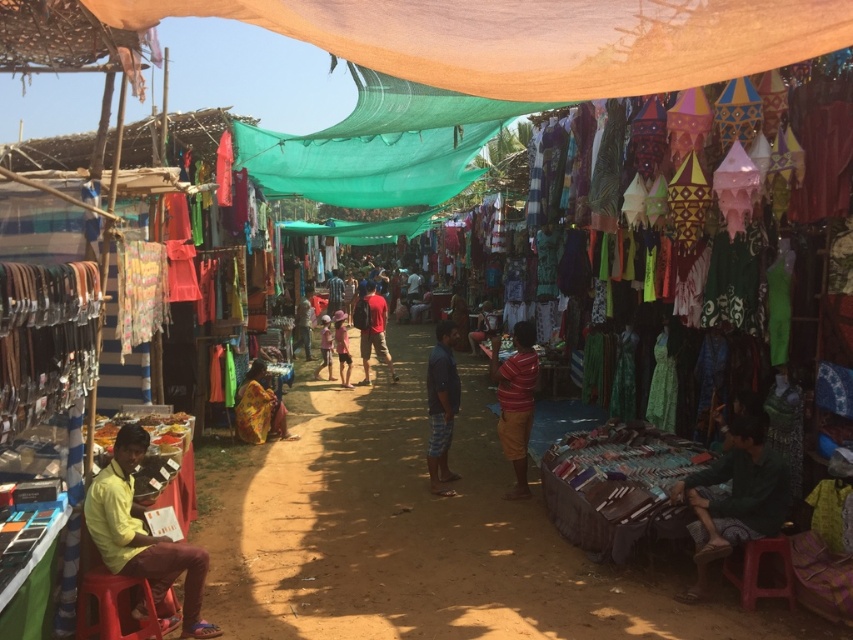
How much distance is there between yellow plastic stool at lower left and light blue fabric at center?

8.63 meters

Does yellow plastic stool at lower left have a lesser height compared to light blue fabric at center?

Yes.

This screenshot has width=853, height=640. Describe the element at coordinates (113, 608) in the screenshot. I see `yellow plastic stool at lower left` at that location.

You are a GUI agent. You are given a task and a screenshot of the screen. Output one action in this format:
    pyautogui.click(x=<x>, y=<y>)
    Task: Click on the yellow plastic stool at lower left
    The image size is (853, 640).
    Given the screenshot: What is the action you would take?
    pyautogui.click(x=113, y=608)

Does point (727, 442) come closer to viewer compared to point (517, 349)?

Yes, point (727, 442) is in front of point (517, 349).

Who is more distant from viewer, (x=770, y=525) or (x=537, y=374)?

The point (x=537, y=374) is more distant.

Which is in front, point (699, 516) or point (521, 404)?

Point (699, 516) is in front.

This screenshot has width=853, height=640. In order to click on green fabric at lower right in this screenshot , I will do `click(734, 497)`.

Is the position of yellow cotton shirt at lower left less distant than that of light blue fabric at center?

Yes, it is.

Can you confirm if yellow cotton shirt at lower left is bigger than light blue fabric at center?

No.

Identify the location of yellow cotton shirt at lower left. The width and height of the screenshot is (853, 640). (143, 538).